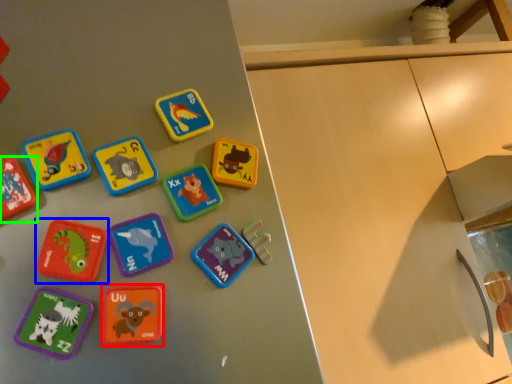
Question: Considering the real-world distances, which object is farthest from toy (highlighted by a red box)? toy (highlighted by a blue box) or toy (highlighted by a green box)?

Choices:
 (A) toy
 (B) toy

Answer: (B)